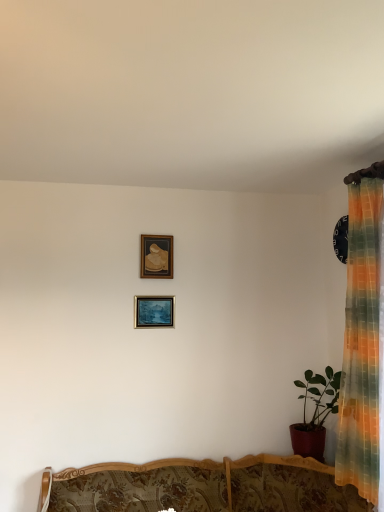
Question: Is matte red pot at right oriented away from wooden picture frame at upper center, arranged as the first picture frame when viewed from the top?

Choices:
 (A) yes
 (B) no

Answer: (B)

Question: Does matte red pot at right have a greater width compared to wooden picture frame at upper center, arranged as the first picture frame when viewed from the top?

Choices:
 (A) yes
 (B) no

Answer: (A)

Question: Is matte red pot at right aimed at wooden picture frame at upper center, arranged as the 2th picture frame when ordered from the bottom?

Choices:
 (A) no
 (B) yes

Answer: (A)

Question: From a real-world perspective, is matte red pot at right on top of wooden picture frame at upper center, arranged as the first picture frame when viewed from the top?

Choices:
 (A) no
 (B) yes

Answer: (A)

Question: Is matte red pot at right not close to wooden picture frame at upper center, arranged as the 2th picture frame when ordered from the bottom?

Choices:
 (A) yes
 (B) no

Answer: (A)

Question: Considering the positions of wooden picture frame at upper center, arranged as the 2th picture frame when ordered from the bottom, and wooden floral-patterned sofa at center in the image, is wooden picture frame at upper center, arranged as the 2th picture frame when ordered from the bottom, wider or thinner than wooden floral-patterned sofa at center?

Choices:
 (A) wide
 (B) thin

Answer: (B)

Question: From a real-world perspective, is wooden picture frame at upper center, arranged as the 2th picture frame when ordered from the bottom, physically located above or below wooden floral-patterned sofa at center?

Choices:
 (A) above
 (B) below

Answer: (A)

Question: From the image's perspective, is wooden picture frame at upper center, arranged as the first picture frame when viewed from the top, above or below wooden floral-patterned sofa at center?

Choices:
 (A) below
 (B) above

Answer: (B)

Question: Is wooden picture frame at upper center, arranged as the 2th picture frame when ordered from the bottom, spatially inside wooden floral-patterned sofa at center, or outside of it?

Choices:
 (A) inside
 (B) outside

Answer: (B)

Question: Do you think matte wooden picture frame at center, the 1th picture frame from the bottom, is within wooden floral-patterned sofa at center, or outside of it?

Choices:
 (A) inside
 (B) outside

Answer: (B)

Question: Does point (135, 300) appear closer or farther from the camera than point (221, 477)?

Choices:
 (A) closer
 (B) farther

Answer: (B)

Question: From the image's perspective, is matte wooden picture frame at center, marked as the second picture frame in a top-to-bottom arrangement, positioned above or below wooden floral-patterned sofa at center?

Choices:
 (A) below
 (B) above

Answer: (B)

Question: Considering the positions of matte wooden picture frame at center, marked as the second picture frame in a top-to-bottom arrangement, and wooden floral-patterned sofa at center in the image, is matte wooden picture frame at center, marked as the second picture frame in a top-to-bottom arrangement, wider or thinner than wooden floral-patterned sofa at center?

Choices:
 (A) wide
 (B) thin

Answer: (B)

Question: From the image's perspective, is matte red pot at right above or below matte wooden picture frame at center, marked as the second picture frame in a top-to-bottom arrangement?

Choices:
 (A) below
 (B) above

Answer: (A)

Question: Which is correct: matte red pot at right is inside matte wooden picture frame at center, the 1th picture frame from the bottom, or outside of it?

Choices:
 (A) inside
 (B) outside

Answer: (B)